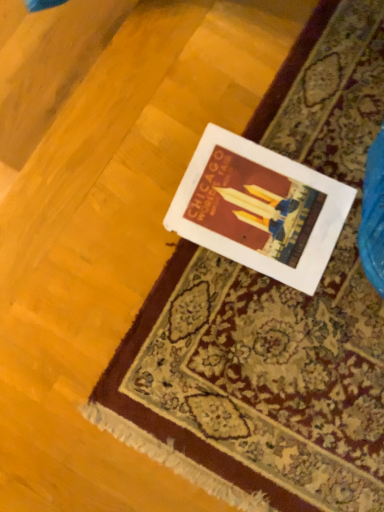
The image size is (384, 512). Identify the location of free space in front of matte paper book at center. (198, 319).